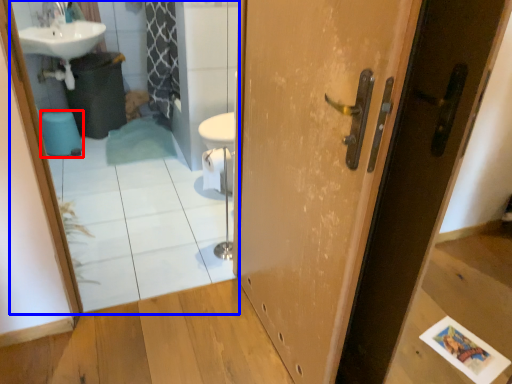
Question: Which object appears closest to the camera in this image, toilet bowl (highlighted by a red box) or mirror (highlighted by a blue box)?

Choices:
 (A) toilet bowl
 (B) mirror

Answer: (B)